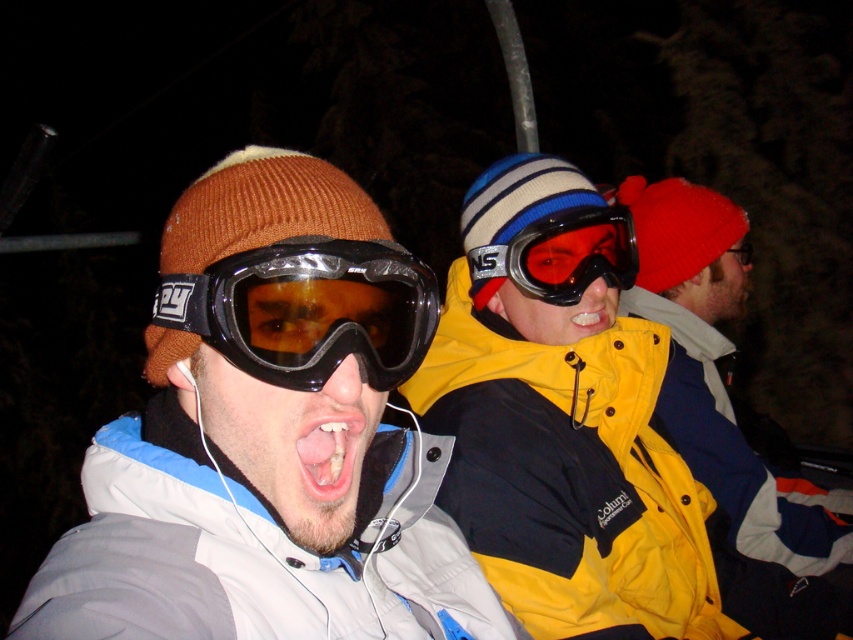
Question: Does matte gray jacket at center appear on the left side of matte yellow jacket at right?

Choices:
 (A) yes
 (B) no

Answer: (A)

Question: Which object appears farthest from the camera in this image?

Choices:
 (A) matte gray jacket at center
 (B) pink glossy lips at center

Answer: (B)

Question: Is matte gray jacket at center wider than matte yellow jacket at right?

Choices:
 (A) yes
 (B) no

Answer: (B)

Question: Estimate the real-world distances between objects in this image. Which object is closer to the matte yellow jacket at right?

Choices:
 (A) transparent plastic goggles at center
 (B) pink glossy lips at center

Answer: (A)

Question: Which of the following is the closest to the observer?

Choices:
 (A) black matte goggles at center
 (B) pink glossy lips at center
 (C) transparent plastic goggles at center
 (D) matte yellow jacket at right

Answer: (A)

Question: From the image, what is the correct spatial relationship of matte yellow jacket at right in relation to pink glossy lips at center?

Choices:
 (A) left
 (B) right

Answer: (B)